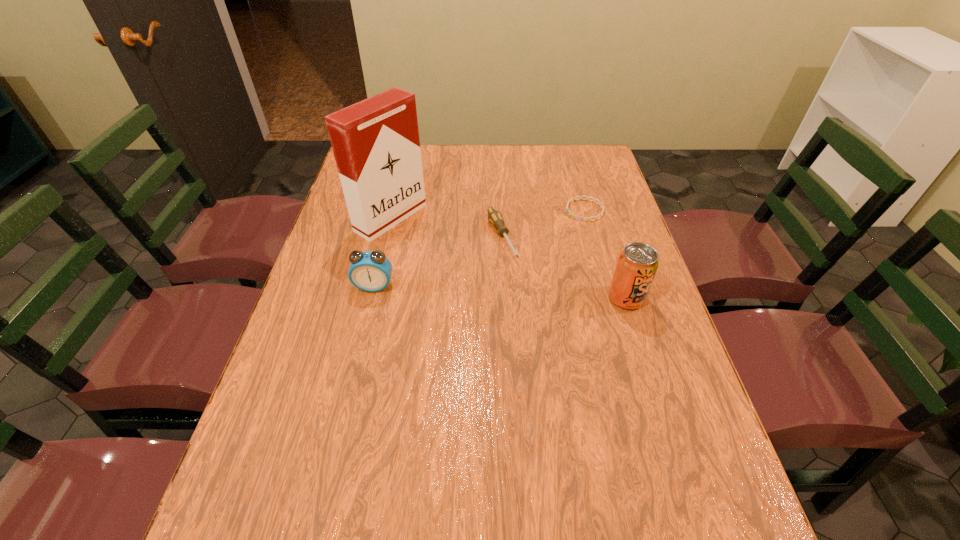
You are a GUI agent. You are given a task and a screenshot of the screen. Output one action in this format:
    pyautogui.click(x=<x>, y=<y>)
    Task: Click on the vacant space on the desktop that is between the alarm clock and the soda can and is positioned on the surface of the shortest object showing star-shaped elements
    
    Given the screenshot: What is the action you would take?
    (x=467, y=291)

Locate an element on the screen. vacant spot on the desktop that is between the alarm clock and the soda can and is positioned on the front-facing side of the tallest object is located at coordinates (524, 293).

Locate an element on the screen. free spot on the desktop that is between the alarm clock and the soda can and is positioned at the tip of the third object from left to right is located at coordinates (533, 294).